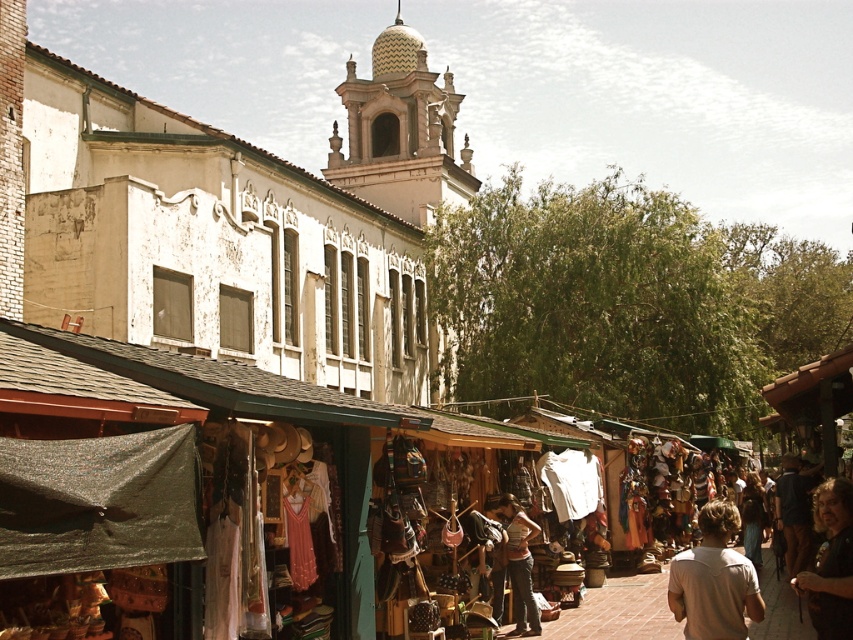
Question: Is light beige cotton shirt at lower right positioned behind light brown leather purse at center?

Choices:
 (A) yes
 (B) no

Answer: (B)

Question: Is light beige cotton shirt at lower right thinner than light brown leather purse at center?

Choices:
 (A) no
 (B) yes

Answer: (A)

Question: Can you confirm if brown leather jacket at lower right is positioned to the right of light brown leather purse at center?

Choices:
 (A) no
 (B) yes

Answer: (B)

Question: Which object appears farthest from the camera in this image?

Choices:
 (A) light brown leather purse at center
 (B) brown leather jacket at lower right

Answer: (A)

Question: Estimate the real-world distances between objects in this image. Which object is closer to the light brown leather purse at center?

Choices:
 (A) brown leather jacket at lower right
 (B) light beige cotton shirt at lower right

Answer: (B)

Question: Estimate the real-world distances between objects in this image. Which object is closer to the light beige cotton shirt at lower right?

Choices:
 (A) brown leather jacket at lower right
 (B) light brown leather purse at center

Answer: (A)